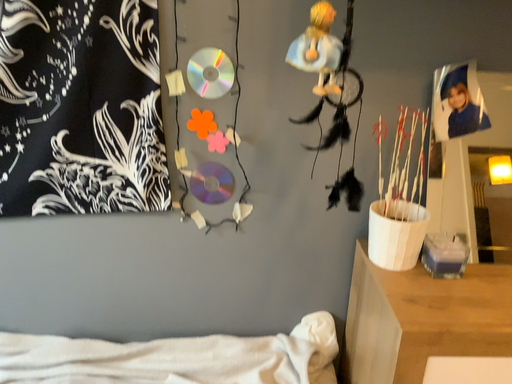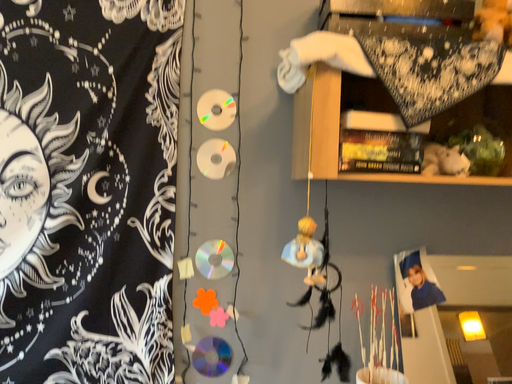
Question: How did the camera likely rotate when shooting the video?

Choices:
 (A) rotated downward
 (B) rotated upward

Answer: (B)